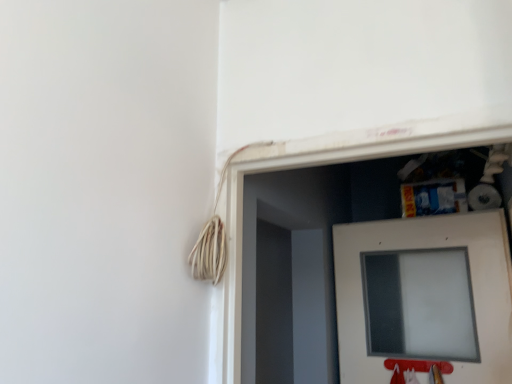
Question: Is frosted glass window at lower right at the right side of white matte door at center?

Choices:
 (A) yes
 (B) no

Answer: (B)

Question: Is frosted glass window at lower right turned away from white matte door at center?

Choices:
 (A) no
 (B) yes

Answer: (B)

Question: From the image's perspective, is frosted glass window at lower right over white matte door at center?

Choices:
 (A) no
 (B) yes

Answer: (A)

Question: Is frosted glass window at lower right at the left side of white matte door at center?

Choices:
 (A) no
 (B) yes

Answer: (B)

Question: From a real-world perspective, is frosted glass window at lower right physically below white matte door at center?

Choices:
 (A) no
 (B) yes

Answer: (B)

Question: Considering the relative sizes of frosted glass window at lower right and white matte door at center in the image provided, is frosted glass window at lower right smaller than white matte door at center?

Choices:
 (A) yes
 (B) no

Answer: (A)

Question: Is white matte door at center facing away from frosted glass window at lower right?

Choices:
 (A) yes
 (B) no

Answer: (A)

Question: Is white matte door at center positioned far away from frosted glass window at lower right?

Choices:
 (A) yes
 (B) no

Answer: (B)

Question: Can we say white matte door at center lies outside frosted glass window at lower right?

Choices:
 (A) no
 (B) yes

Answer: (B)

Question: From the image's perspective, is white matte door at center under frosted glass window at lower right?

Choices:
 (A) no
 (B) yes

Answer: (A)

Question: Does white matte door at center touch frosted glass window at lower right?

Choices:
 (A) no
 (B) yes

Answer: (B)

Question: From a real-world perspective, is white matte door at center located beneath frosted glass window at lower right?

Choices:
 (A) yes
 (B) no

Answer: (B)

Question: From the image's perspective, relative to frosted glass window at lower right, is white matte door at center above or below?

Choices:
 (A) above
 (B) below

Answer: (A)